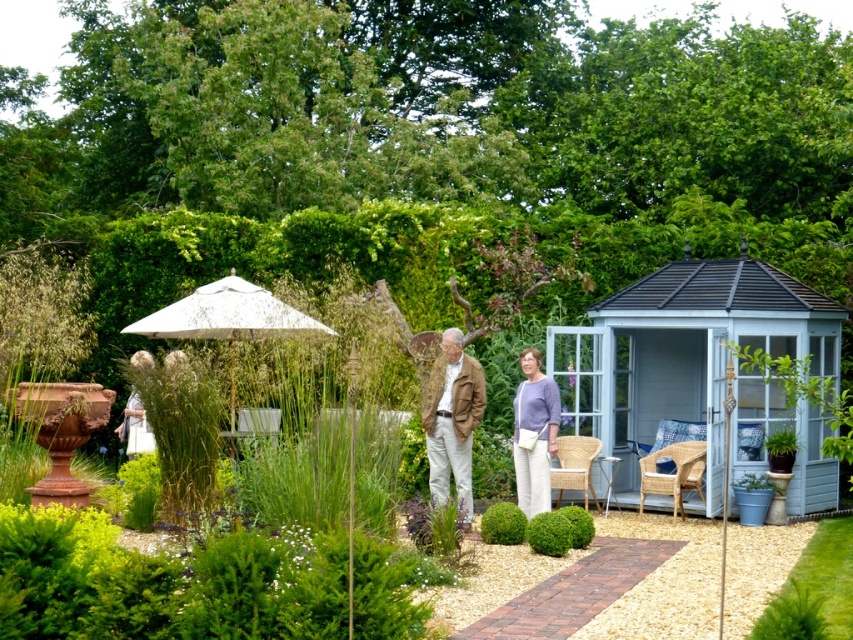
Question: Is khaki cotton jacket at center wider than green textured ball at center?

Choices:
 (A) yes
 (B) no

Answer: (A)

Question: Based on their relative distances, which object is farther from the khaki cotton jacket at center?

Choices:
 (A) light blue wooden gazebo at right
 (B) green textured ball at center
 (C) light purple fabric purse at center

Answer: (A)

Question: Estimate the real-world distances between objects in this image. Which object is farther from the light blue wooden gazebo at right?

Choices:
 (A) green textured ball at center
 (B) green fuzzy ball at center
 (C) white fabric umbrella at center

Answer: (C)

Question: Does khaki cotton jacket at center come in front of green textured ball at center?

Choices:
 (A) no
 (B) yes

Answer: (B)

Question: Which of these objects is positioned farthest from the light purple fabric purse at center?

Choices:
 (A) white fabric umbrella at center
 (B) green fuzzy ball at center
 (C) khaki cotton jacket at center
 (D) green leafy plant at lower right

Answer: (D)

Question: Is light blue wooden gazebo at right wider than light purple fabric purse at center?

Choices:
 (A) yes
 (B) no

Answer: (A)